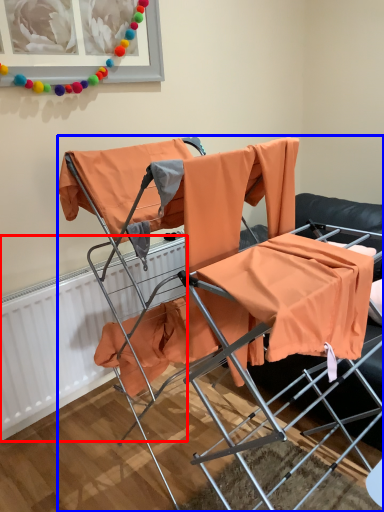
Question: Which of the following is the farthest to the observer, radiator (highlighted by a red box) or chair (highlighted by a blue box)?

Choices:
 (A) radiator
 (B) chair

Answer: (A)